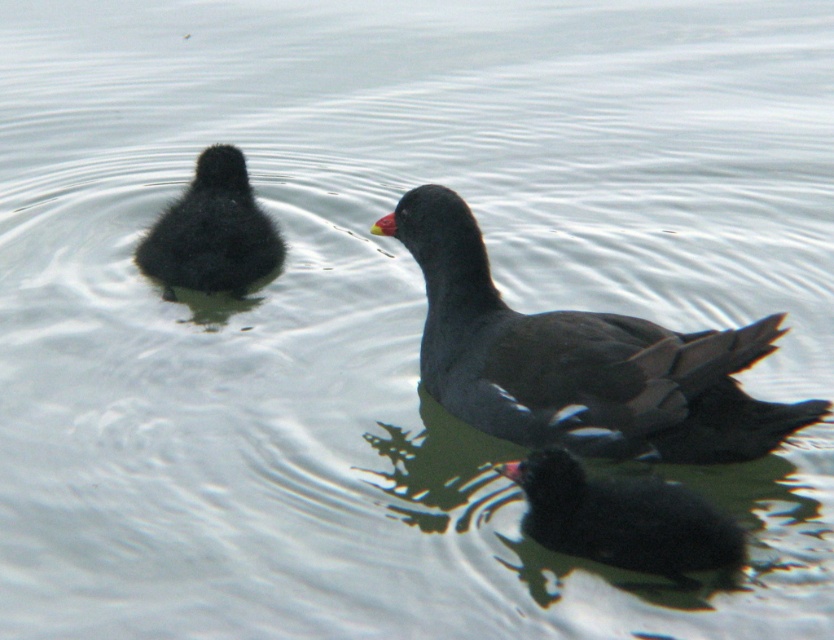
Question: Which object appears closest to the camera in this image?

Choices:
 (A) black matte duckling at upper left
 (B) dark gray matte duck at center

Answer: (B)

Question: Is dark gray matte duck at center thinner than black matte duckling at upper left?

Choices:
 (A) yes
 (B) no

Answer: (B)

Question: Observing the image, what is the correct spatial positioning of black matte duckling at lower right in reference to black matte duckling at upper left?

Choices:
 (A) above
 (B) below

Answer: (B)

Question: Which of the following is the farthest from the observer?

Choices:
 (A) (538, 540)
 (B) (227, 205)

Answer: (B)

Question: Is dark gray matte duck at center in front of black matte duckling at upper left?

Choices:
 (A) yes
 (B) no

Answer: (A)

Question: Which of the following is the farthest from the observer?

Choices:
 (A) dark gray matte duck at center
 (B) black matte duckling at upper left
 (C) black matte duckling at lower right

Answer: (B)